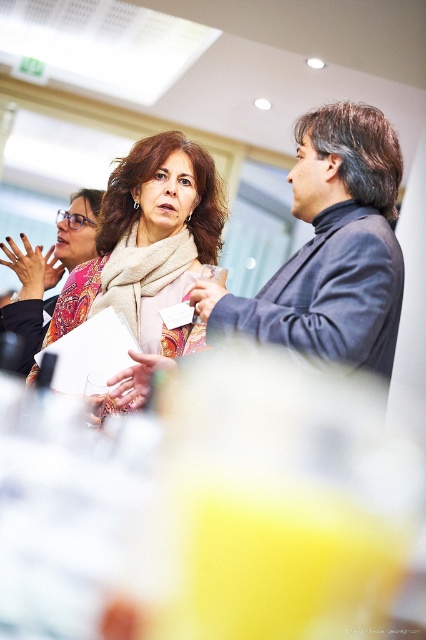
Question: Which point appears closest to the camera in this image?

Choices:
 (A) (376, 145)
 (B) (163, 196)
 (C) (109, 397)
 (D) (206, 284)

Answer: (A)

Question: Does matte pink scarf at center have a larger size compared to matte plastic cup at center?

Choices:
 (A) yes
 (B) no

Answer: (A)

Question: Does matte pink scarf at center appear under matte plastic cup at center?

Choices:
 (A) no
 (B) yes

Answer: (B)

Question: Is dark blue sweater at center thinner than matte pink scarf at center?

Choices:
 (A) yes
 (B) no

Answer: (B)

Question: Among these objects, which one is farthest from the camera?

Choices:
 (A) matte beige scarf at center
 (B) dark blue sweater at center

Answer: (A)

Question: Which point is closer to the camera?

Choices:
 (A) matte pink scarf at center
 (B) matte beige scarf at center

Answer: (A)